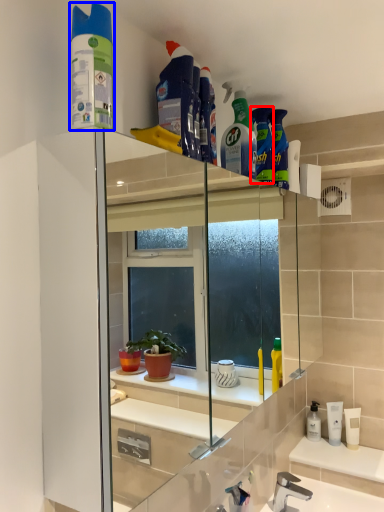
Question: Which object is closer to the camera taking this photo, cleaning product (highlighted by a red box) or cleaning product (highlighted by a blue box)?

Choices:
 (A) cleaning product
 (B) cleaning product

Answer: (B)